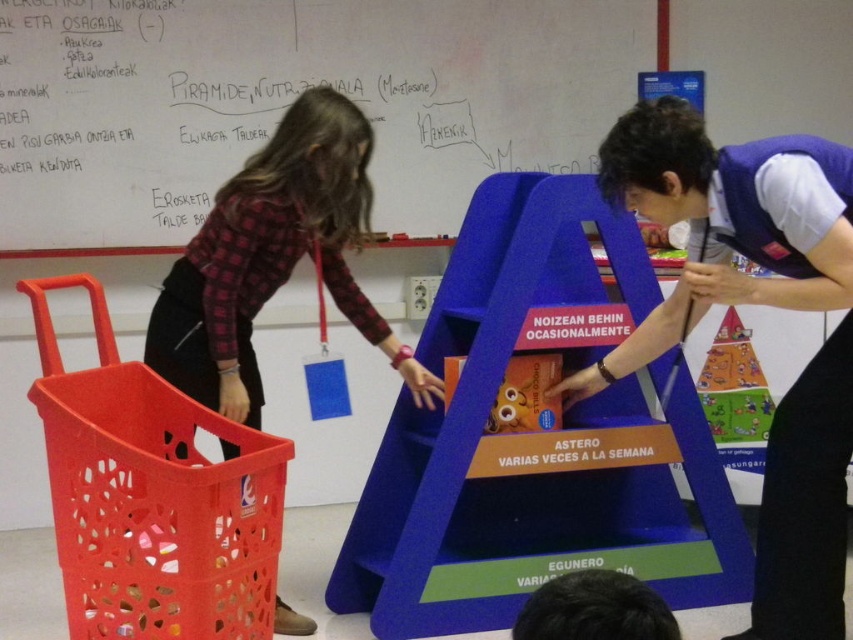
You are standing in the classroom and want to touch the plaid fabric shirt at center and the matte plastic toy at center. Which one can you reach first without moving your position?

The plaid fabric shirt at center is closer to the viewer than the matte plastic toy at center, so you can reach it first without moving.

You are a student in the classroom and need to place a book on the tallest object available. Which object should you choose between the matte blue pyramid at center and the orange plastic basket at left?

The matte blue pyramid at center is taller than the orange plastic basket at left, so you should place the book on the matte blue pyramid at center.

You are a teacher in the classroom and want to ensure that all students can see the plaid fabric shirt at center and the matte plastic toy at center during a presentation. Which object should you move closer to the front to ensure visibility for everyone?

The plaid fabric shirt at center is wider than the matte plastic toy at center, so moving the plaid fabric shirt at center closer to the front will ensure better visibility for all students.